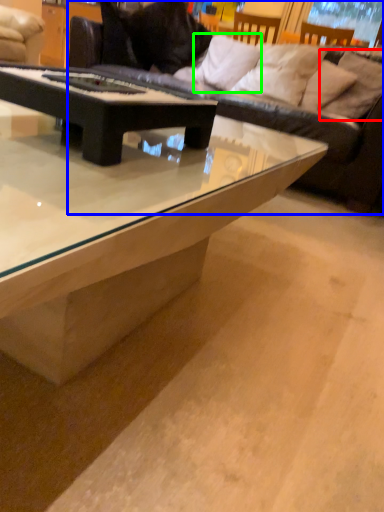
Question: Which is farther away from pillow (highlighted by a red box)? studio couch (highlighted by a blue box) or pillow (highlighted by a green box)?

Choices:
 (A) studio couch
 (B) pillow

Answer: (B)